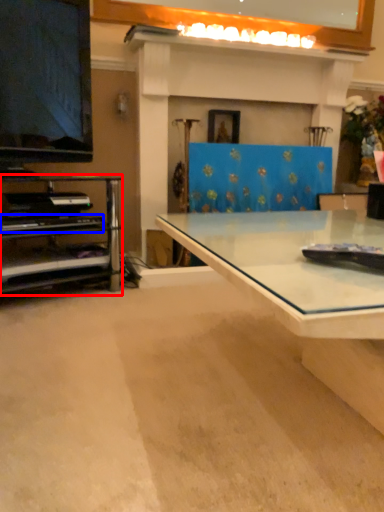
Question: Which point is further to the camera, shelf (highlighted by a red box) or piano (highlighted by a blue box)?

Choices:
 (A) shelf
 (B) piano

Answer: (B)